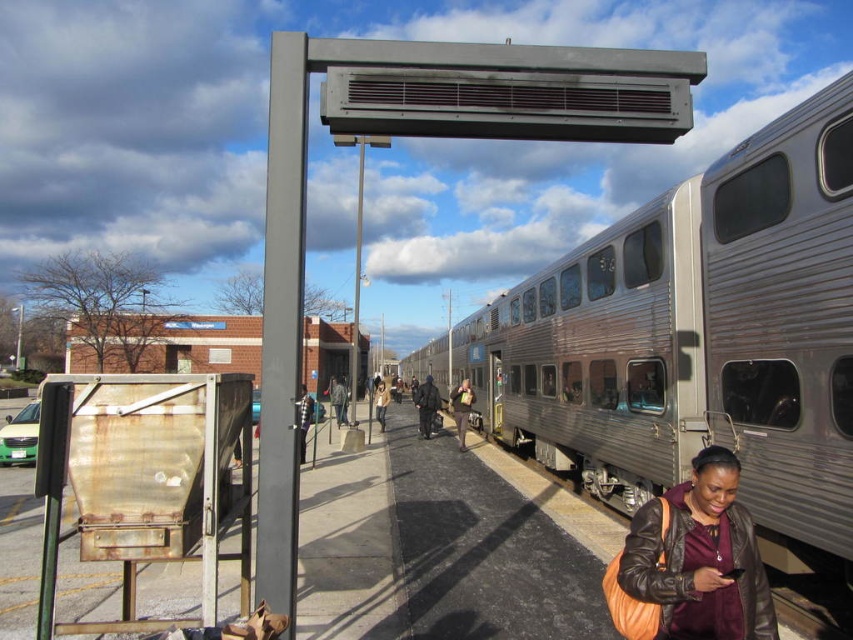
Does silver metallic train at center have a lesser height compared to leather jacket at lower right?

Incorrect, silver metallic train at center's height does not fall short of leather jacket at lower right's.

Between silver metallic train at center and leather jacket at lower right, which one appears on the right side from the viewer's perspective?

From the viewer's perspective, leather jacket at lower right appears more on the right side.

Between point (689, 211) and point (641, 516), which one is positioned in front?

Point (641, 516) is more forward.

The height and width of the screenshot is (640, 853). I want to click on silver metallic train at center, so point(695,339).